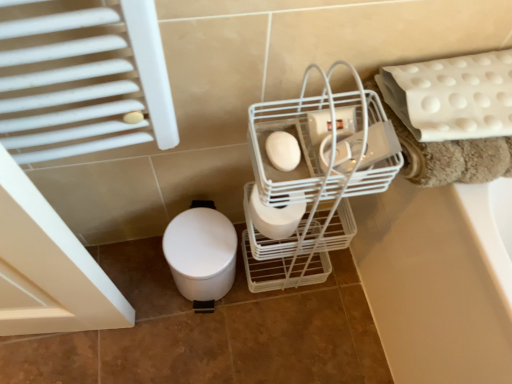
Question: Does white matte toilet at lower left come behind white wire basket at center?

Choices:
 (A) yes
 (B) no

Answer: (A)

Question: Does white matte toilet at lower left have a lesser height compared to white wire basket at center?

Choices:
 (A) no
 (B) yes

Answer: (B)

Question: Is white matte toilet at lower left next to white wire basket at center?

Choices:
 (A) no
 (B) yes

Answer: (A)

Question: Does white matte toilet at lower left have a greater width compared to white wire basket at center?

Choices:
 (A) no
 (B) yes

Answer: (B)

Question: From the image's perspective, is white matte toilet at lower left located beneath white wire basket at center?

Choices:
 (A) yes
 (B) no

Answer: (A)

Question: From the image's perspective, is white matte toilet paper at center, marked as the 2th toilet paper in a top-to-bottom arrangement, positioned above or below white wire basket at center?

Choices:
 (A) above
 (B) below

Answer: (B)

Question: Is white matte toilet paper at center, the 2th toilet paper viewed from the front, taller or shorter than white wire basket at center?

Choices:
 (A) short
 (B) tall

Answer: (A)

Question: In the image, is white matte toilet paper at center, marked as the 2th toilet paper in a top-to-bottom arrangement, on the left side or the right side of white wire basket at center?

Choices:
 (A) right
 (B) left

Answer: (B)

Question: Does point (291, 231) appear closer or farther from the camera than point (329, 177)?

Choices:
 (A) closer
 (B) farther

Answer: (B)

Question: Looking at the image, does white matte toilet at lower left seem bigger or smaller compared to white wire basket at center?

Choices:
 (A) big
 (B) small

Answer: (B)

Question: From their relative heights in the image, would you say white matte toilet at lower left is taller or shorter than white wire basket at center?

Choices:
 (A) tall
 (B) short

Answer: (B)

Question: Do you think white matte toilet at lower left is within white wire basket at center, or outside of it?

Choices:
 (A) outside
 (B) inside

Answer: (A)

Question: In the image, is white matte toilet at lower left positioned in front of or behind white wire basket at center?

Choices:
 (A) behind
 (B) front

Answer: (A)

Question: Is white matte toilet paper at center, the first toilet paper viewed from the top, bigger or smaller than white matte toilet paper at center, marked as the 2th toilet paper in a top-to-bottom arrangement?

Choices:
 (A) small
 (B) big

Answer: (A)

Question: In terms of width, does white matte toilet paper at center, the 2th toilet paper when ordered from bottom to top, look wider or thinner when compared to white matte toilet paper at center, which is the first toilet paper in bottom-to-top order?

Choices:
 (A) thin
 (B) wide

Answer: (A)